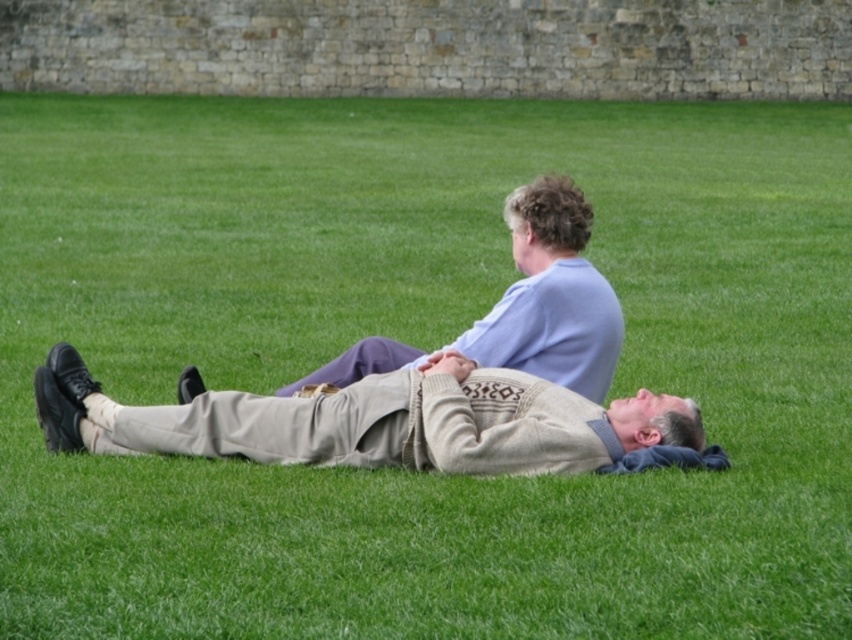
Question: Does knit sweater at center lie behind light blue fabric shirt at upper center?

Choices:
 (A) no
 (B) yes

Answer: (A)

Question: Which point is farther to the camera?

Choices:
 (A) (563, 438)
 (B) (376, 340)

Answer: (B)

Question: Which object is farther from the camera taking this photo?

Choices:
 (A) light blue fabric shirt at upper center
 (B) knit sweater at center

Answer: (A)

Question: From the image, what is the correct spatial relationship of knit sweater at center in relation to light blue fabric shirt at upper center?

Choices:
 (A) right
 (B) left

Answer: (B)

Question: Which object appears closest to the camera in this image?

Choices:
 (A) knit sweater at center
 (B) light blue fabric shirt at upper center

Answer: (A)

Question: Where is knit sweater at center located in relation to light blue fabric shirt at upper center in the image?

Choices:
 (A) below
 (B) above

Answer: (A)